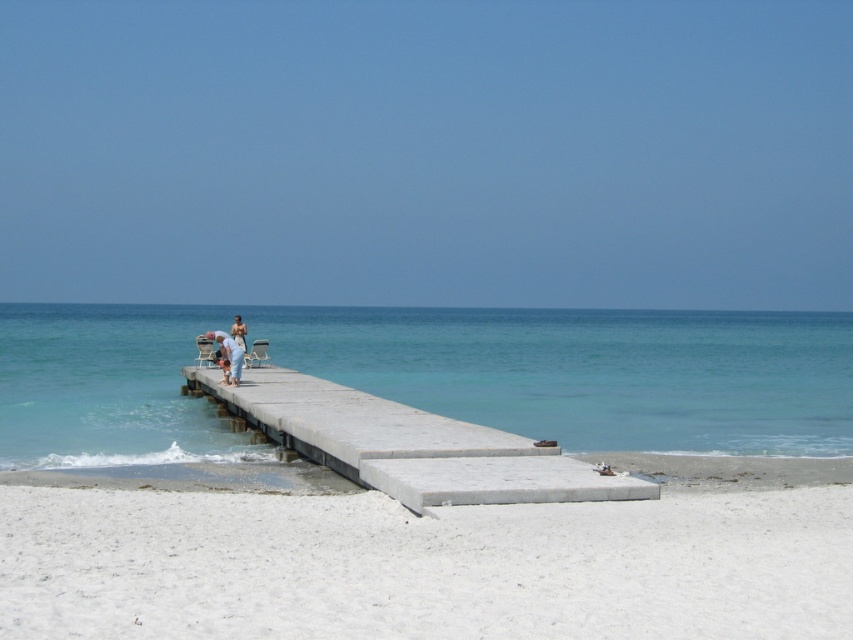
From the picture: You are standing on the concrete pier and want to walk to the white sandy beach at lower center. Based on the coordinates provided in the Objects Description, in which general direction should you head?

The white sandy beach at lower center is located at coordinates point (424, 566). Since the beach is at lower center, you should head downward from the pier towards the lower part of the image to reach it.

You are planning to build a small sandcastle on the white sandy beach at lower center. Considering the space available, do you think you can also add a moat around it using the clear blue water at center?

The white sandy beach at lower center occupies less space than the clear blue water at center, so there may not be enough space to build a sandcastle with a moat using the available beach area.

You are a beachgoer who wants to set up your metallic silver beach chair at center on the white sandy beach at lower center. Considering the size of the beach area, will you have enough space to place the chair comfortably?

The white sandy beach at lower center is smaller than the metallic silver beach chair at center, so there may not be enough space to place the chair comfortably.